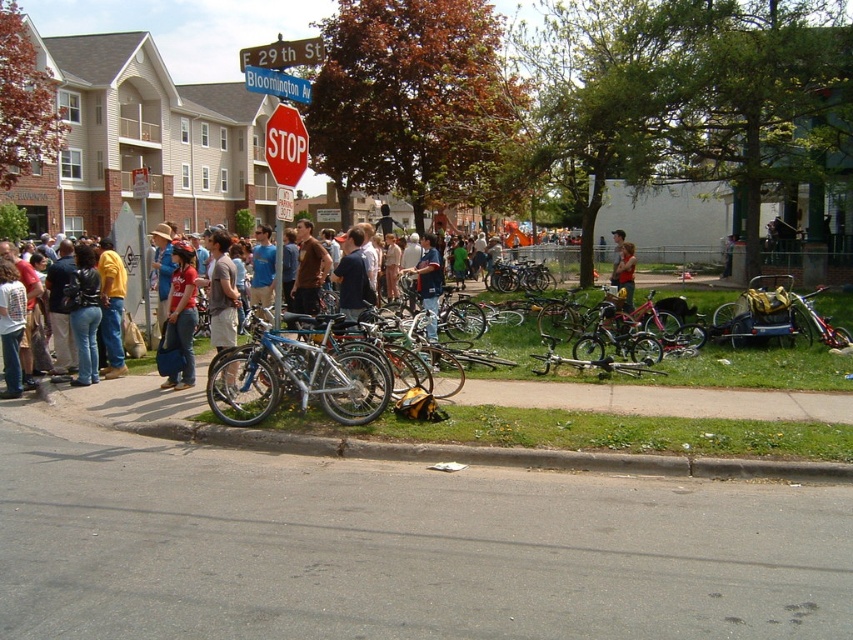
Question: Among these objects, which one is nearest to the camera?

Choices:
 (A) denim shorts at center
 (B) red stop sign at upper center

Answer: (B)

Question: Is matte red shirt at center positioned in front of red stop sign at upper center?

Choices:
 (A) yes
 (B) no

Answer: (B)

Question: Is denim shorts at center in front of red matte stop sign at center?

Choices:
 (A) yes
 (B) no

Answer: (B)

Question: Which object is positioned farthest from the red plastic stop sign at upper center?

Choices:
 (A) red stop sign at upper center
 (B) matte red shirt at center
 (C) denim shorts at center
 (D) silver metallic bicycle at center

Answer: (A)

Question: Does denim shorts at center come in front of red plastic stop sign at upper center?

Choices:
 (A) no
 (B) yes

Answer: (B)

Question: Which object is the closest to the gray concrete curb at lower center?

Choices:
 (A) denim shorts at center
 (B) red plastic stop sign at upper center
 (C) silver metallic bicycle at center

Answer: (C)